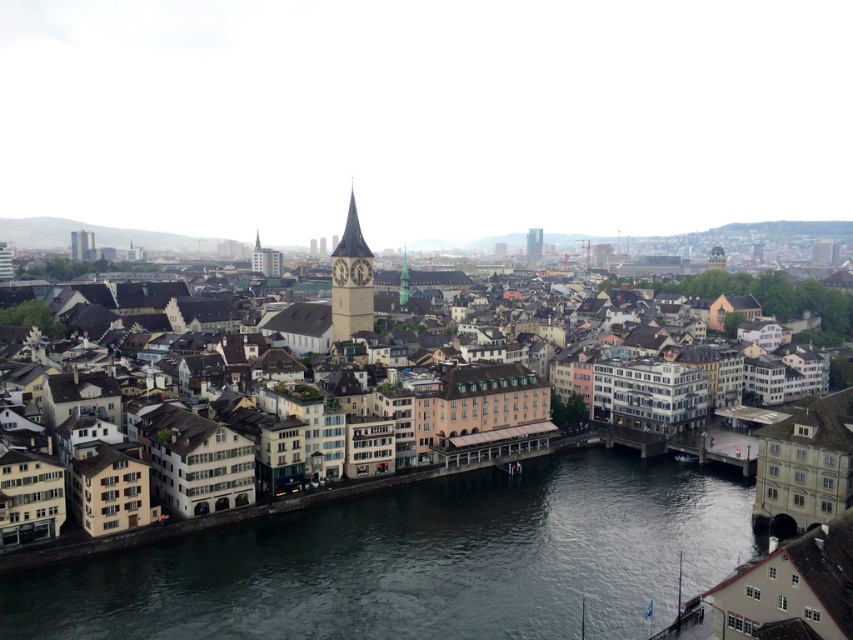
You are a tourist standing on the riverbank and want to take a photo that includes both the dark gray water at center and the smooth stone tower at center. Which object should you frame first in your camera to ensure both are visible?

You should frame the dark gray water at center first since it is larger in size than the smooth stone tower at center, allowing enough space for both in the photo.

You are a tourist standing on the riverbank and want to take a photo of the dark gray water at center and the glassy modern skyscraper at center. Which object should you frame first in your camera to ensure both are in the shot?

You should frame the dark gray water at center first because it might be wider than the glassy modern skyscraper at center, ensuring both fit within the camera frame.

You are standing on a bridge overlooking the dark gray water at center and the glassy modern skyscraper at center. Which object is closer to you?

The dark gray water at center is closer to the viewer than the glassy modern skyscraper at center.